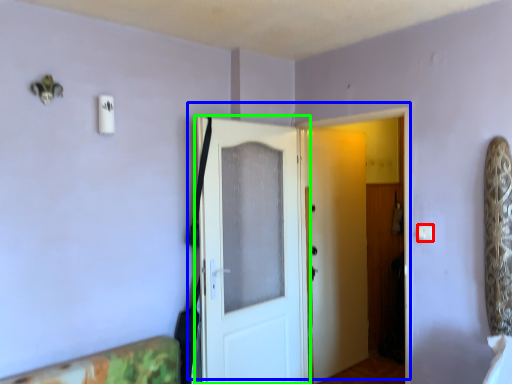
Question: Which object is positioned closest to light switch (highlighted by a red box)? Select from door (highlighted by a blue box) and door (highlighted by a green box).

Choices:
 (A) door
 (B) door

Answer: (A)